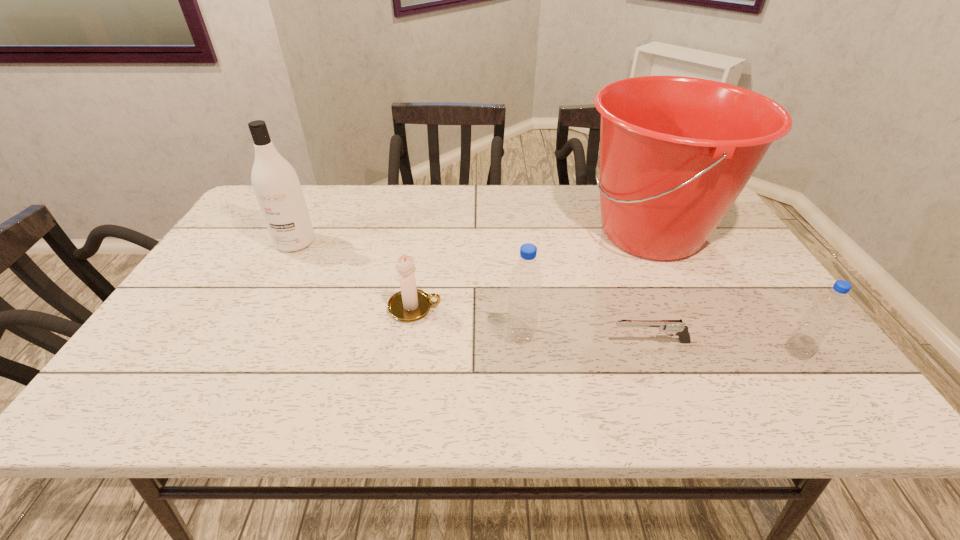
In order to click on free space that satisfies the following two spatial constraints: 1. on the handle side of the fourth tallest object; 2. on the left side of the fourth nearest object in this screenshot , I will do `click(408, 352)`.

Locate an element on the screen. This screenshot has width=960, height=540. free space that satisfies the following two spatial constraints: 1. on the handle side of the third farthest object; 2. on the back side of the right water bottle is located at coordinates pyautogui.click(x=408, y=352).

Find the location of a particular element. Image resolution: width=960 pixels, height=540 pixels. free space that satisfies the following two spatial constraints: 1. on the handle side of the candle holder; 2. on the left side of the fourth object from right to left is located at coordinates (411, 335).

What are the coordinates of `free space in the image that satisfies the following two spatial constraints: 1. on the front-facing side of the leftmost object; 2. on the left side of the taller water bottle` in the screenshot? It's located at (247, 335).

Where is `vacant area in the image that satisfies the following two spatial constraints: 1. on the front-facing side of the right water bottle; 2. on the right side of the shampoo`? vacant area in the image that satisfies the following two spatial constraints: 1. on the front-facing side of the right water bottle; 2. on the right side of the shampoo is located at coordinates (237, 352).

Locate an element on the screen. The width and height of the screenshot is (960, 540). free space that satisfies the following two spatial constraints: 1. on the front-facing side of the right water bottle; 2. on the left side of the leftmost object is located at coordinates (237, 352).

Find the location of `blank area in the image that satisfies the following two spatial constraints: 1. on the front-facing side of the leftmost object; 2. on the right side of the fourth tallest object`. blank area in the image that satisfies the following two spatial constraints: 1. on the front-facing side of the leftmost object; 2. on the right side of the fourth tallest object is located at coordinates (237, 352).

Image resolution: width=960 pixels, height=540 pixels. What are the coordinates of `vacant position in the image that satisfies the following two spatial constraints: 1. on the handle side of the taller water bottle; 2. on the left side of the candle holder` in the screenshot? It's located at (411, 335).